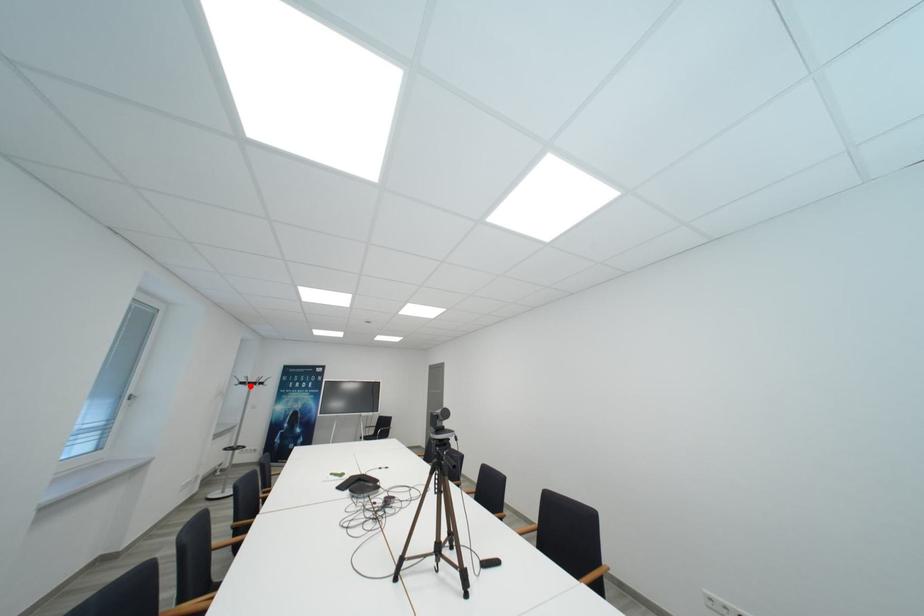
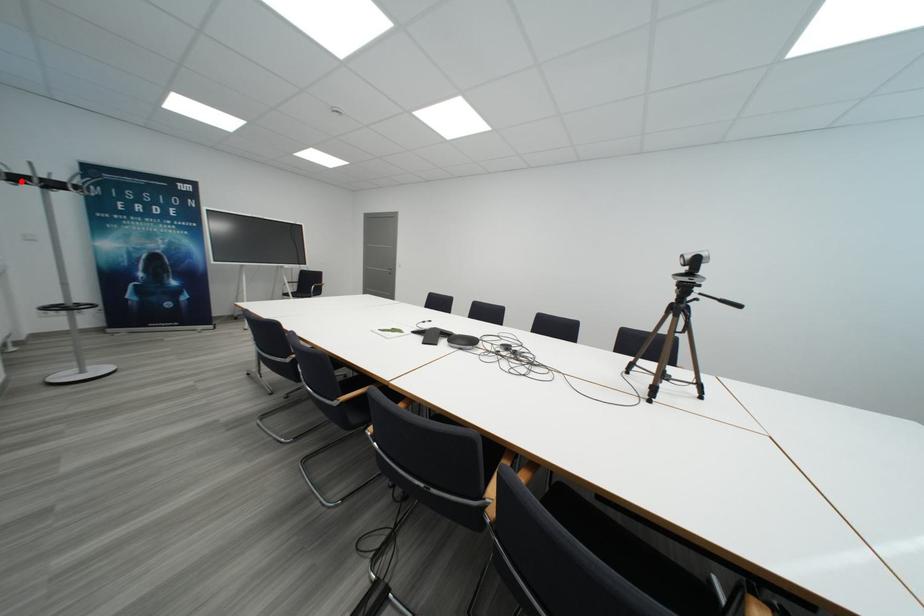
I am providing you with two images of the same scene from different viewpoints. A red point is marked on the first image and another point is marked on the second image. Do the highlighted points in image1 and image2 indicate the same real-world spot?

Yes